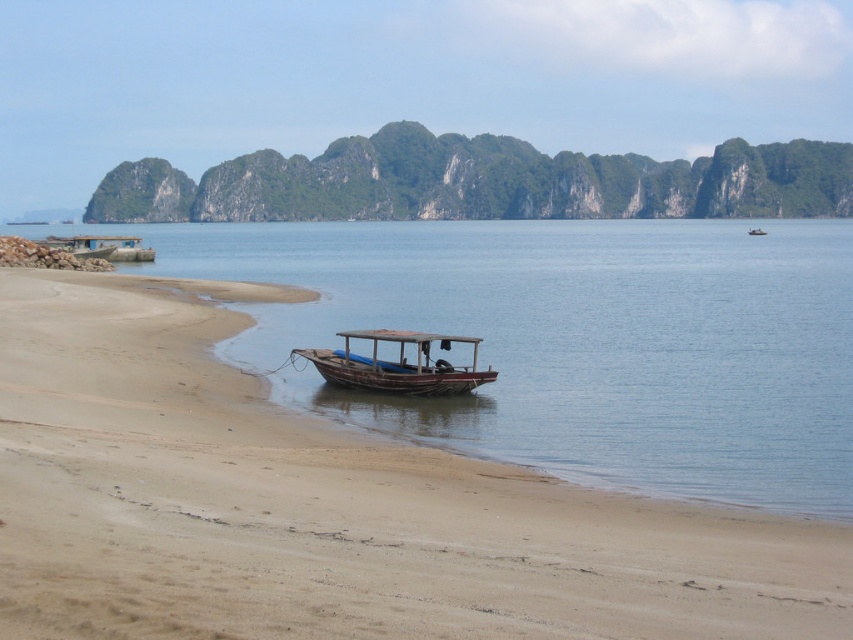
Does brown sandy beach at center have a greater height compared to rusty wooden boat at center?

Yes, brown sandy beach at center is taller than rusty wooden boat at center.

Can you confirm if brown sandy beach at center is positioned below rusty wooden boat at center?

Indeed, brown sandy beach at center is positioned under rusty wooden boat at center.

The height and width of the screenshot is (640, 853). What do you see at coordinates (328, 506) in the screenshot?
I see `brown sandy beach at center` at bounding box center [328, 506].

You are a GUI agent. You are given a task and a screenshot of the screen. Output one action in this format:
    pyautogui.click(x=<x>, y=<y>)
    Task: Click on the brown sandy beach at center
    The height and width of the screenshot is (640, 853).
    Given the screenshot: What is the action you would take?
    pyautogui.click(x=328, y=506)